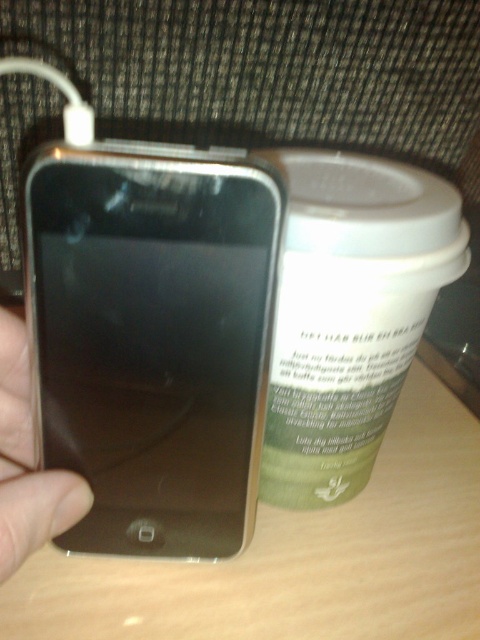
Question: Does satin gold ipod at left appear on the left side of metallic silver phone at left?

Choices:
 (A) no
 (B) yes

Answer: (A)

Question: Which object is farther from the camera taking this photo?

Choices:
 (A) satin gold ipod at left
 (B) metallic silver phone at left

Answer: (B)

Question: Which point is farther to the camera?

Choices:
 (A) coord(27,259)
 (B) coord(9,515)

Answer: (A)

Question: In this image, where is satin gold ipod at left located relative to metallic silver phone at left?

Choices:
 (A) below
 (B) above

Answer: (B)

Question: Is satin gold ipod at left below metallic silver phone at left?

Choices:
 (A) yes
 (B) no

Answer: (B)